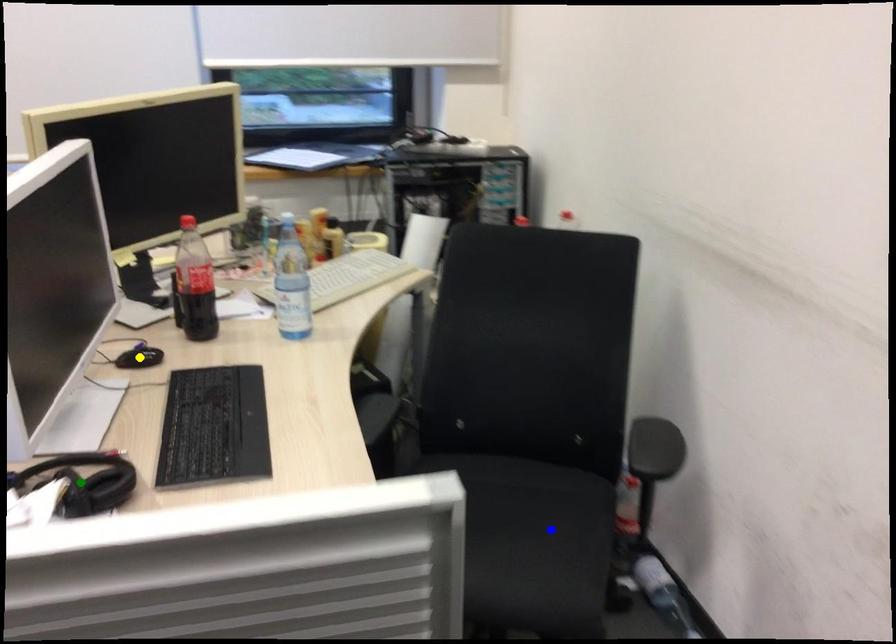
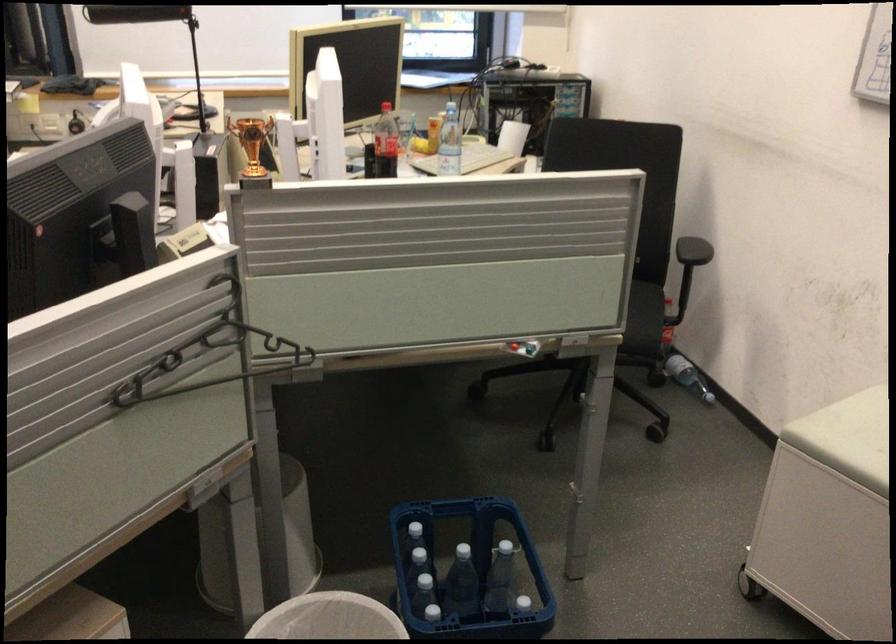
I am providing you with two images of the same scene from different viewpoints. Three points are marked in image1. Which point corresponds to a part or object that is occluded in image2?In image1, three points are marked. Which of them correspond to a part or object that is occluded in image2?Among the three points shown in image1, which one corresponds to a part or object that is no longer visible due to occlusion in image2?

blue point, yellow point, green point